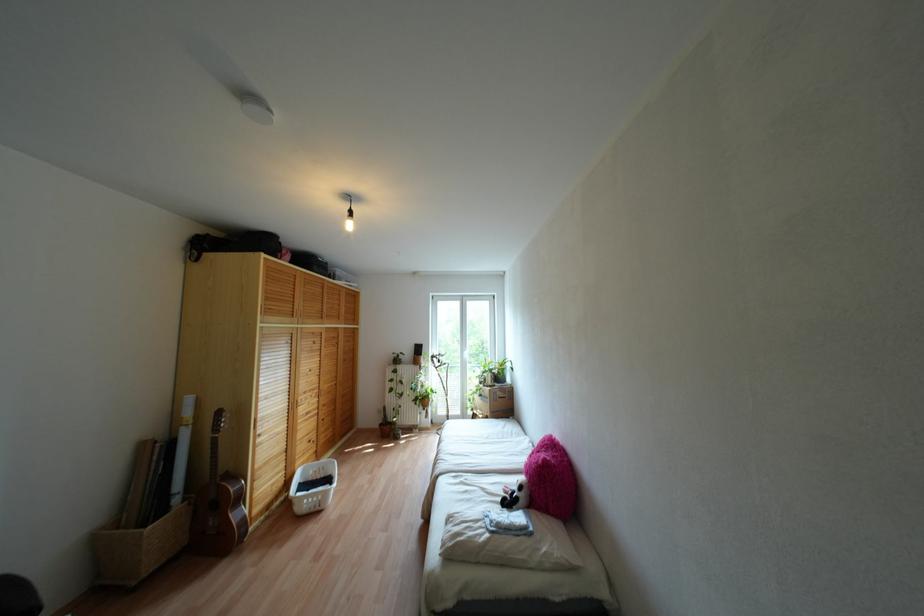
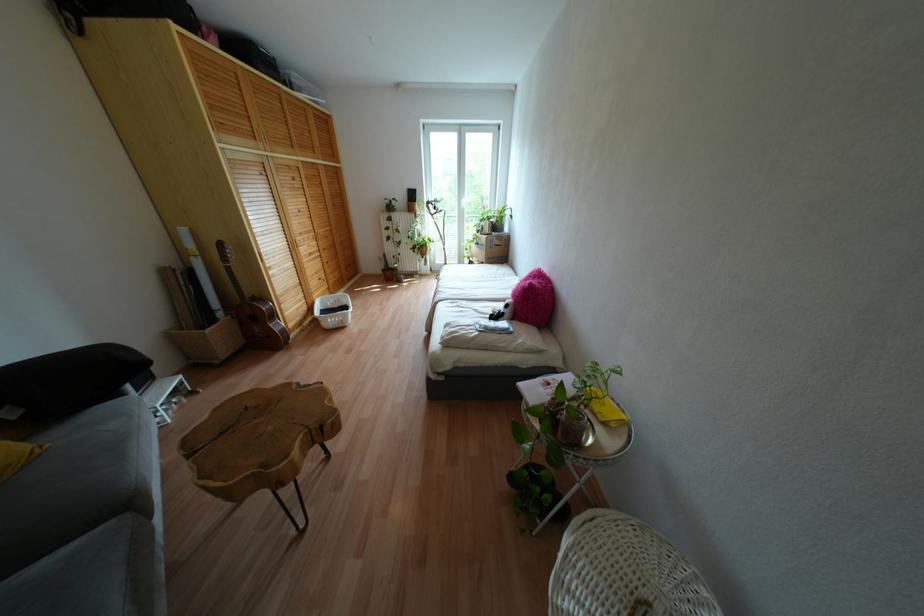
Question: The images are taken continuously from a first-person perspective. In which direction is your viewpoint rotating?

Choices:
 (A) Left
 (B) Right
 (C) Up
 (D) Down

Answer: (D)